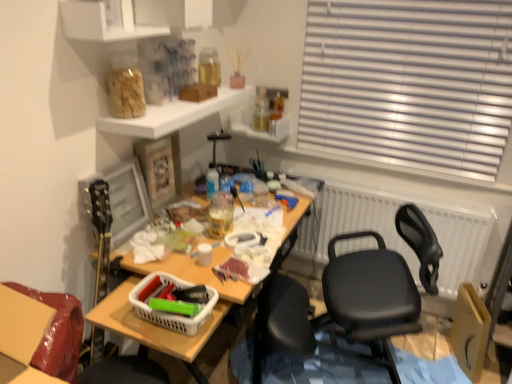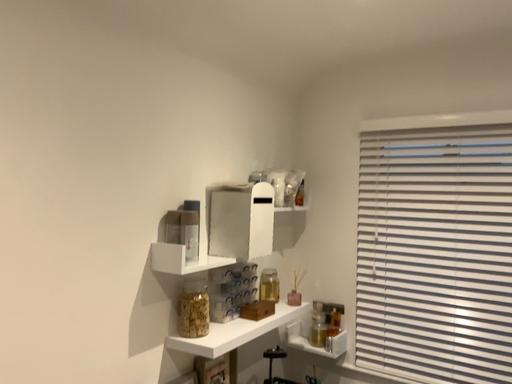
Question: How did the camera likely rotate when shooting the video?

Choices:
 (A) rotated downward
 (B) rotated upward

Answer: (B)